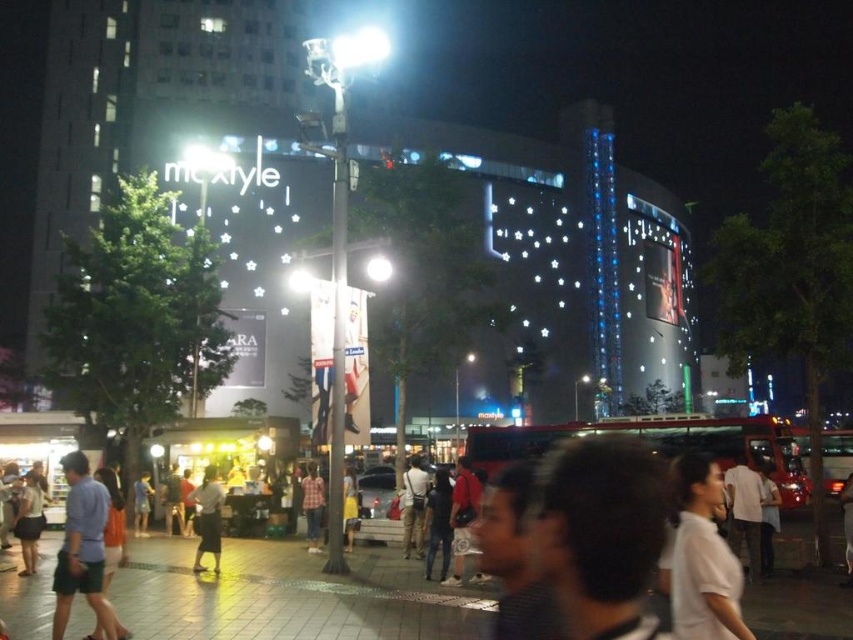
You are standing in the middle of the street in front of the building. There are two points marked on the ground in front of you. The first point is at coordinate point (77, 461) and the second point is at coordinate point (316, 538). Which point is closer to you?

Point (77, 461) is closer to the viewer than point (316, 538).

You are standing at the entrance of the building and want to find the white matte shirt at center. According to the coordinates provided, in which direction should you look to locate it?

The white matte shirt at center is located at point (701, 557), which means it is positioned to the lower right of the image. Since you are at the entrance, you should look towards the lower right direction to find it.

You are standing at the point with coordinates point (689, 458) and want to walk towards the building entrance located at point (196, 564). Will you have to go forward or backward to reach the entrance?

Since point (689, 458) is in front of point (196, 564), you will have to go backward to reach the entrance.